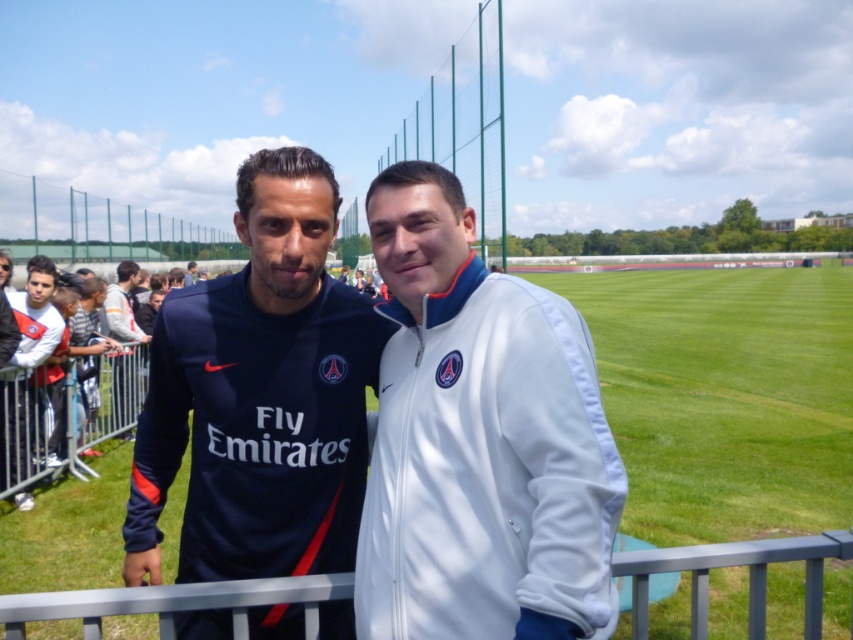
Who is shorter, white fabric jacket at center or white jersey at center?

white fabric jacket at center

Who is positioned more to the left, white fabric jacket at center or white jersey at center?

From the viewer's perspective, white jersey at center appears more on the left side.

This screenshot has width=853, height=640. Find the location of `white fabric jacket at center`. white fabric jacket at center is located at coordinates (479, 440).

At what (x,y) coordinates should I click in order to perform the action: click on white fabric jacket at center. Please return your answer as a coordinate pair (x, y). The width and height of the screenshot is (853, 640). Looking at the image, I should click on (479, 440).

Who is taller, dark blue jersey at center or white jersey at center?

Standing taller between the two is white jersey at center.

Who is positioned more to the right, dark blue jersey at center or white jersey at center?

dark blue jersey at center is more to the right.

Where is `dark blue jersey at center`? This screenshot has height=640, width=853. dark blue jersey at center is located at coordinates (260, 394).

Does dark blue jersey at center have a lesser width compared to metallic gray rail at lower center?

No.

Does dark blue jersey at center have a greater height compared to metallic gray rail at lower center?

Correct, dark blue jersey at center is much taller as metallic gray rail at lower center.

Is point (323, 426) positioned before point (190, 588)?

No, (323, 426) is behind (190, 588).

Where is `dark blue jersey at center`? dark blue jersey at center is located at coordinates (260, 394).